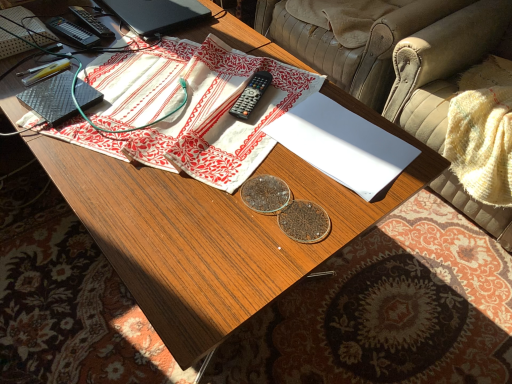
Locate an element on the screen. Image resolution: width=512 pixels, height=384 pixels. free space in front of white paper at center is located at coordinates (314, 210).